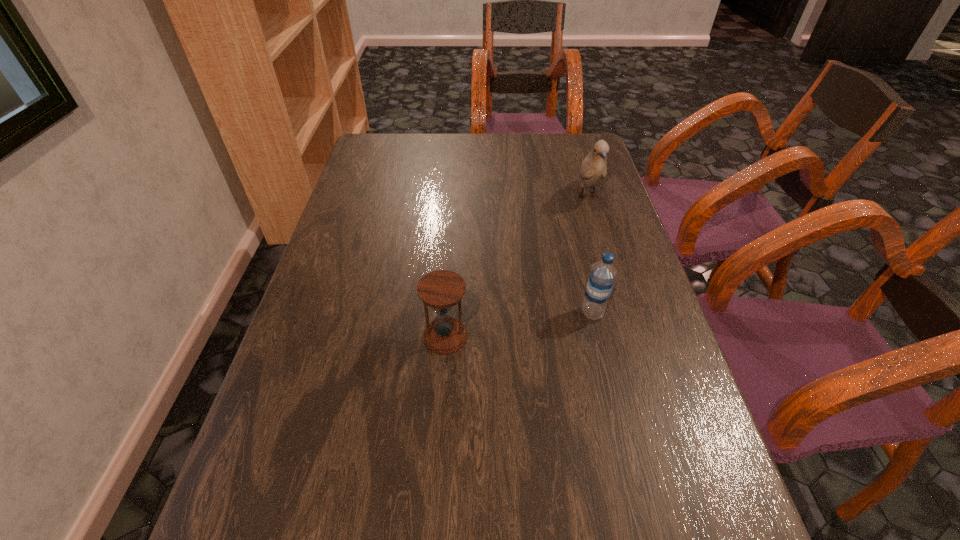
Identify the location of water bottle at the right edge. The height and width of the screenshot is (540, 960). (602, 276).

The height and width of the screenshot is (540, 960). In the image, there is a desktop. Identify the location of free space at the far edge. (433, 151).

At what (x,y) coordinates should I click in order to perform the action: click on free space at the left edge of the desktop. Please return your answer as a coordinate pair (x, y). The image size is (960, 540). Looking at the image, I should click on (341, 302).

I want to click on free space at the right edge, so click(x=572, y=252).

In the image, there is a desktop. Where is `vacant space at the far right corner`? The width and height of the screenshot is (960, 540). vacant space at the far right corner is located at coordinates (571, 147).

Identify the location of vacant point located between the leftmost object and the second object from left to right. The height and width of the screenshot is (540, 960). (519, 325).

Identify the location of free point between the rightmost object and the hourglass. The image size is (960, 540). (516, 267).

Where is `free area in between the water bottle and the bird`? The width and height of the screenshot is (960, 540). free area in between the water bottle and the bird is located at coordinates (590, 255).

Identify the location of free space between the bird and the second object from right to left. The image size is (960, 540). (590, 255).

You are a GUI agent. You are given a task and a screenshot of the screen. Output one action in this format:
    pyautogui.click(x=<x>, y=<y>)
    Task: Click on the vacant space that is in between the farthest object and the hourglass
    The image size is (960, 540).
    Given the screenshot: What is the action you would take?
    pyautogui.click(x=516, y=267)